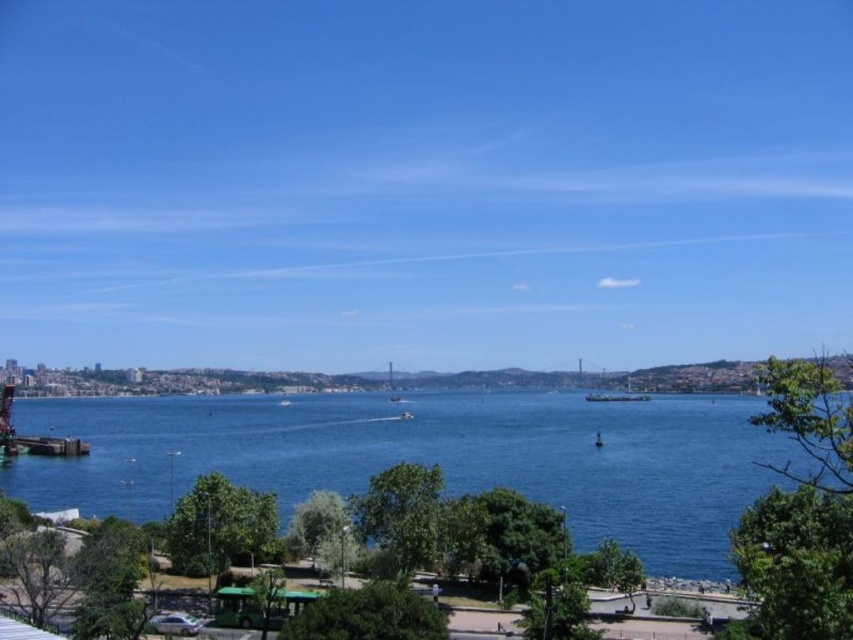
You are standing at the wooden dock at lower left and want to walk towards the blue water at center. Which direction should you go?

Since the blue water at center is closer to the viewer than the wooden dock at lower left, you should walk forward towards the blue water at center as it is nearer to your current position.

You are planning to place a new bench in the park. The bench requires a space wider than the wooden dock at lower left. Based on the scene, is there a suitable location near the blue water at center where the bench can fit?

The blue water at center has a larger width than the wooden dock at lower left, so the area near the blue water at center would provide enough space to place the bench.

You are planning to paint a seascape and need to know which area to focus on for a larger portion of your painting. Based on the scene, which object should you prioritize in terms of size between the blue water at center and the wooden dock at lower left?

The blue water at center is larger in size than the wooden dock at lower left, so you should prioritize painting the blue water at center for a larger portion of your painting.